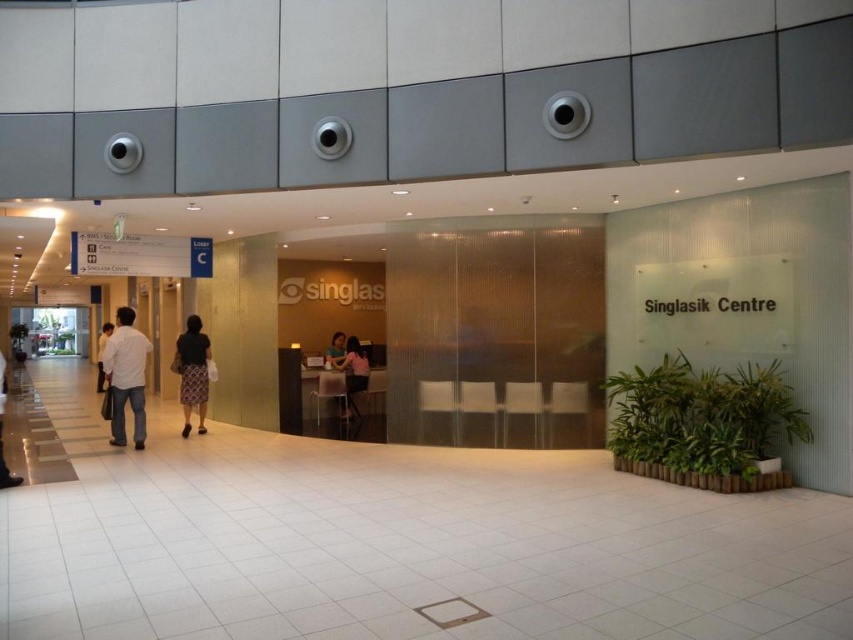
Question: Where is matte black skirt at center located in relation to white casual pants at left in the image?

Choices:
 (A) above
 (B) below

Answer: (A)

Question: Which is farther from the pink fabric shirt at center?

Choices:
 (A) white casual pants at left
 (B) light beige shirt at left

Answer: (B)

Question: Observing the image, what is the correct spatial positioning of white matte shirt at left in reference to light beige shirt at left?

Choices:
 (A) above
 (B) below

Answer: (A)

Question: Is white matte shirt at left to the left of matte black skirt at center from the viewer's perspective?

Choices:
 (A) yes
 (B) no

Answer: (A)

Question: Among these points, which one is nearest to the camera?

Choices:
 (A) (132, 348)
 (B) (345, 340)
 (C) (1, 365)
 (D) (109, 330)

Answer: (C)

Question: Which of the following is the farthest from the observer?

Choices:
 (A) light beige shirt at left
 (B) pink fabric shirt at center
 (C) white casual pants at left
 (D) matte black skirt at center

Answer: (B)